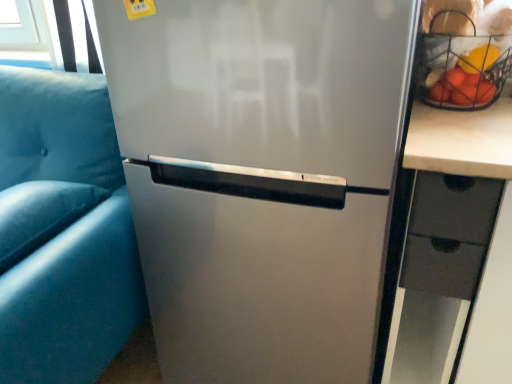
This screenshot has width=512, height=384. I want to click on metallic wire basket at upper right, so click(466, 55).

Describe the element at coordinates (262, 179) in the screenshot. The width and height of the screenshot is (512, 384). I see `satin silver refrigerator at center` at that location.

At what (x,y) coordinates should I click in order to perform the action: click on matte blue armchair at left. Please return your answer as a coordinate pair (x, y). Looking at the image, I should click on (64, 232).

This screenshot has height=384, width=512. What do you see at coordinates (64, 232) in the screenshot?
I see `matte blue armchair at left` at bounding box center [64, 232].

At what (x,y) coordinates should I click in order to perform the action: click on suede-like blue pillow at left. Please return your answer as a coordinate pair (x, y). Looking at the image, I should click on (40, 214).

Find the location of `metallic wire basket at upper right`. metallic wire basket at upper right is located at coordinates tap(466, 55).

Is satin silver refrigerator at center taller than matte blue armchair at left?

Yes.

Looking at their sizes, would you say satin silver refrigerator at center is wider or thinner than matte blue armchair at left?

satin silver refrigerator at center is thinner than matte blue armchair at left.

Is matte blue armchair at left at the back of satin silver refrigerator at center?

That's not correct — satin silver refrigerator at center is not looking away from matte blue armchair at left.

Considering the sizes of matte black drawer at right and metallic wire basket at upper right in the image, is matte black drawer at right wider or thinner than metallic wire basket at upper right?

matte black drawer at right is wider than metallic wire basket at upper right.

Is matte black drawer at right in front of or behind metallic wire basket at upper right in the image?

matte black drawer at right is in front of metallic wire basket at upper right.

From a real-world perspective, is matte black drawer at right on top of metallic wire basket at upper right?

No, from a real-world perspective, matte black drawer at right is not above metallic wire basket at upper right.

Considering the sizes of suede-like blue pillow at left and matte blue armchair at left in the image, is suede-like blue pillow at left taller or shorter than matte blue armchair at left?

In the image, suede-like blue pillow at left appears to be shorter than matte blue armchair at left.

Is suede-like blue pillow at left not within matte blue armchair at left?

Actually, suede-like blue pillow at left is at least partially inside matte blue armchair at left.

Considering the sizes of suede-like blue pillow at left and matte blue armchair at left in the image, is suede-like blue pillow at left wider or thinner than matte blue armchair at left?

suede-like blue pillow at left is thinner than matte blue armchair at left.

Is satin silver refrigerator at center at the back of suede-like blue pillow at left?

No, suede-like blue pillow at left's orientation is not away from satin silver refrigerator at center.

Which is more to the left, suede-like blue pillow at left or satin silver refrigerator at center?

suede-like blue pillow at left.

Considering the relative sizes of suede-like blue pillow at left and satin silver refrigerator at center in the image provided, is suede-like blue pillow at left smaller than satin silver refrigerator at center?

Yes, suede-like blue pillow at left is smaller than satin silver refrigerator at center.

From the image's perspective, between suede-like blue pillow at left and satin silver refrigerator at center, which one is located above?

satin silver refrigerator at center.

From a real-world perspective, which is physically below, matte blue armchair at left or satin silver refrigerator at center?

In real-world perspective, matte blue armchair at left is lower.

Is matte blue armchair at left aimed at satin silver refrigerator at center?

No, matte blue armchair at left does not turn towards satin silver refrigerator at center.

From the picture: Which is more to the right, matte blue armchair at left or satin silver refrigerator at center?

satin silver refrigerator at center.

From a real-world perspective, is matte black drawer at right located higher than satin silver refrigerator at center?

Yes, from a real-world perspective, matte black drawer at right is on top of satin silver refrigerator at center.

Can you tell me how much matte black drawer at right and satin silver refrigerator at center differ in facing direction?

They differ by 1.15 degrees in their facing directions.

Is matte black drawer at right taller or shorter than satin silver refrigerator at center?

In the image, matte black drawer at right appears to be shorter than satin silver refrigerator at center.

Consider the image. Is matte black drawer at right in front of or behind satin silver refrigerator at center in the image?

matte black drawer at right is behind satin silver refrigerator at center.

Is matte blue armchair at left oriented away from metallic wire basket at upper right?

No, matte blue armchair at left is not facing the opposite direction of metallic wire basket at upper right.

Is matte blue armchair at left wider than metallic wire basket at upper right?

Yes, matte blue armchair at left is wider than metallic wire basket at upper right.

Based on the photo, from a real-world perspective, is matte blue armchair at left located higher than metallic wire basket at upper right?

No, from a real-world perspective, matte blue armchair at left is not above metallic wire basket at upper right.

Image resolution: width=512 pixels, height=384 pixels. In the image, there is a satin silver refrigerator at center. Find the location of `armchair below it (from a real-world perspective)`. armchair below it (from a real-world perspective) is located at coordinates (64, 232).

Image resolution: width=512 pixels, height=384 pixels. I want to click on basket on the right of matte black drawer at right, so click(466, 55).

From the image, which object appears to be nearer to matte black drawer at right, suede-like blue pillow at left or metallic wire basket at upper right?

metallic wire basket at upper right.

Based on their spatial positions, is matte blue armchair at left or matte black drawer at right closer to suede-like blue pillow at left?

matte blue armchair at left is closer to suede-like blue pillow at left.

Estimate the real-world distances between objects in this image. Which object is closer to metallic wire basket at upper right, matte blue armchair at left or satin silver refrigerator at center?

satin silver refrigerator at center is positioned closer to the anchor metallic wire basket at upper right.

Looking at the image, which one is located closer to matte black drawer at right, suede-like blue pillow at left or satin silver refrigerator at center?

satin silver refrigerator at center is closer to matte black drawer at right.

Which object lies nearer to the anchor point matte blue armchair at left, satin silver refrigerator at center or matte black drawer at right?

satin silver refrigerator at center is closer to matte blue armchair at left.

Based on their spatial positions, is matte blue armchair at left or matte black drawer at right closer to satin silver refrigerator at center?

Based on the image, matte blue armchair at left appears to be nearer to satin silver refrigerator at center.

From the image, which object appears to be nearer to matte blue armchair at left, matte black drawer at right or suede-like blue pillow at left?

suede-like blue pillow at left.

Looking at the image, which one is located further to suede-like blue pillow at left, metallic wire basket at upper right or satin silver refrigerator at center?

metallic wire basket at upper right lies further to suede-like blue pillow at left than the other object.

Image resolution: width=512 pixels, height=384 pixels. I want to click on pillow between matte blue armchair at left and metallic wire basket at upper right, so click(x=40, y=214).

Identify the location of pillow between matte blue armchair at left and satin silver refrigerator at center in the horizontal direction. (40, 214).

The width and height of the screenshot is (512, 384). Find the location of `drawer situated between satin silver refrigerator at center and metallic wire basket at upper right from left to right`. drawer situated between satin silver refrigerator at center and metallic wire basket at upper right from left to right is located at coordinates (455, 207).

You are a GUI agent. You are given a task and a screenshot of the screen. Output one action in this format:
    pyautogui.click(x=<x>, y=<y>)
    Task: Click on the refrigerator situated between matte blue armchair at left and metallic wire basket at upper right from left to right
    
    Given the screenshot: What is the action you would take?
    pyautogui.click(x=262, y=179)